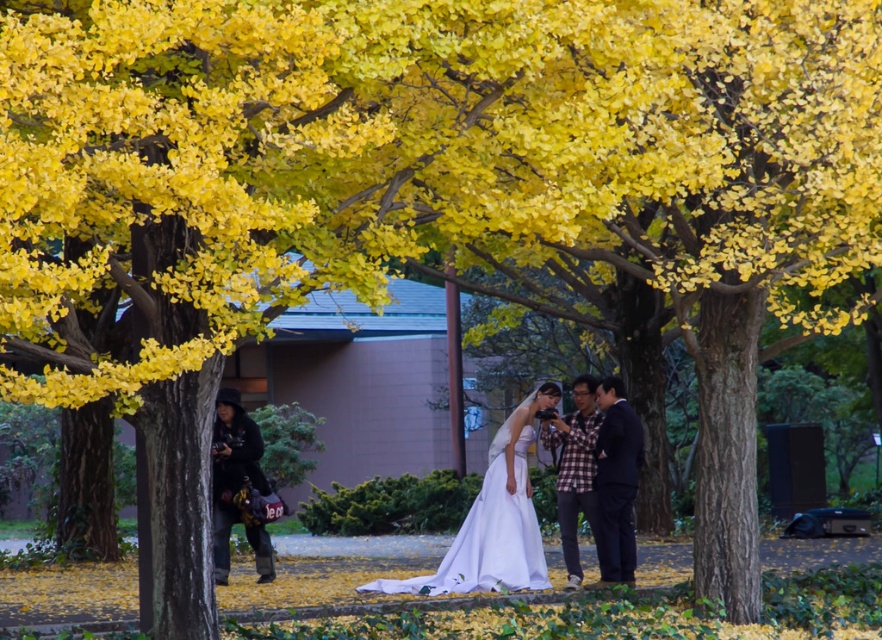
Question: Can you confirm if yellow leafy tree at center is positioned to the left of white satin dress at center?

Choices:
 (A) yes
 (B) no

Answer: (A)

Question: Which of these objects is positioned farthest from the yellow leafy tree at center?

Choices:
 (A) plaid fabric shirt at center
 (B) white satin dress at center
 (C) dark blue suit at center

Answer: (A)

Question: Estimate the real-world distances between objects in this image. Which object is closer to the yellow leafy tree at center?

Choices:
 (A) white satin dress at center
 (B) plaid fabric shirt at center
 (C) dark blue suit at center

Answer: (C)

Question: Observing the image, what is the correct spatial positioning of white satin dress at center in reference to dark blue suit at center?

Choices:
 (A) left
 (B) right

Answer: (A)

Question: Where is white satin dress at center located in relation to plaid fabric shirt at center in the image?

Choices:
 (A) below
 (B) above

Answer: (A)

Question: Which point is closer to the camera?

Choices:
 (A) plaid fabric shirt at center
 (B) white satin dress at center
 (C) yellow leafy tree at center
 (D) dark blue suit at center

Answer: (C)